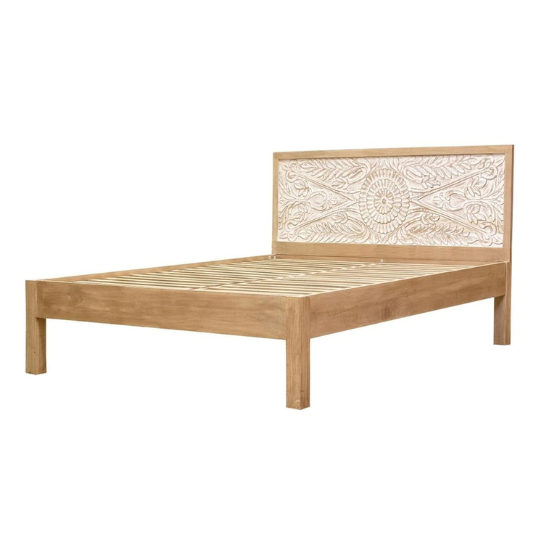
At what (x,y) coordinates should I click in order to perform the action: click on front left bed leg. Please return your answer as a coordinate pair (x, y). The width and height of the screenshot is (544, 544). Looking at the image, I should click on (298, 366).